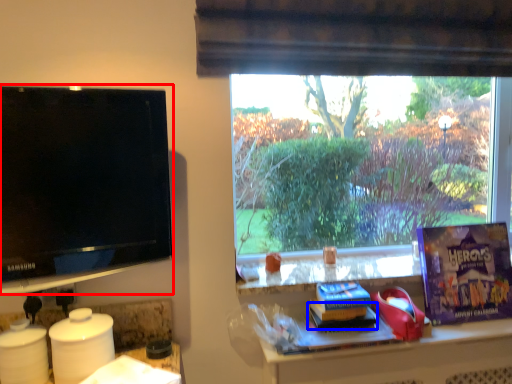
Question: Among these objects, which one is nearest to the camera, television (highlighted by a red box) or book (highlighted by a blue box)?

Choices:
 (A) television
 (B) book

Answer: (A)